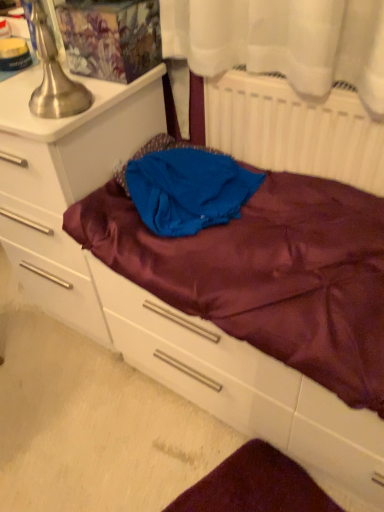
Question: From the image's perspective, is brushed metal table lamp at upper left above or below matte white chest of drawers at left?

Choices:
 (A) below
 (B) above

Answer: (B)

Question: Considering the positions of brushed metal table lamp at upper left and matte white chest of drawers at left in the image, is brushed metal table lamp at upper left bigger or smaller than matte white chest of drawers at left?

Choices:
 (A) big
 (B) small

Answer: (B)

Question: Which of these objects is positioned farthest from the satin purple drawer at center?

Choices:
 (A) white matte radiator at upper right
 (B) brushed metal table lamp at upper left
 (C) matte white chest of drawers at left
 (D) blue satin cloth at center

Answer: (B)

Question: Estimate the real-world distances between objects in this image. Which object is closer to the white matte radiator at upper right?

Choices:
 (A) blue satin cloth at center
 (B) satin purple drawer at center
 (C) matte white chest of drawers at left
 (D) brushed metal table lamp at upper left

Answer: (A)